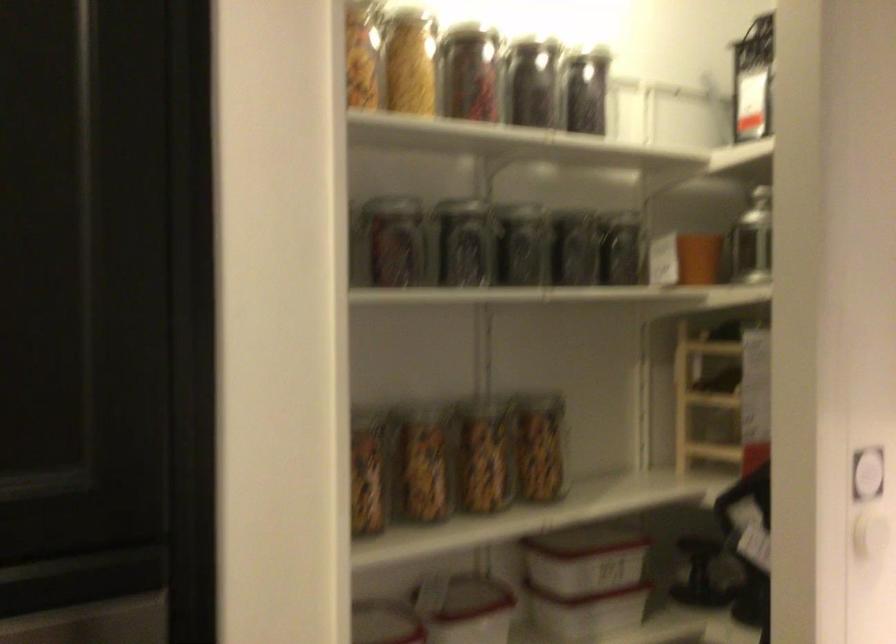
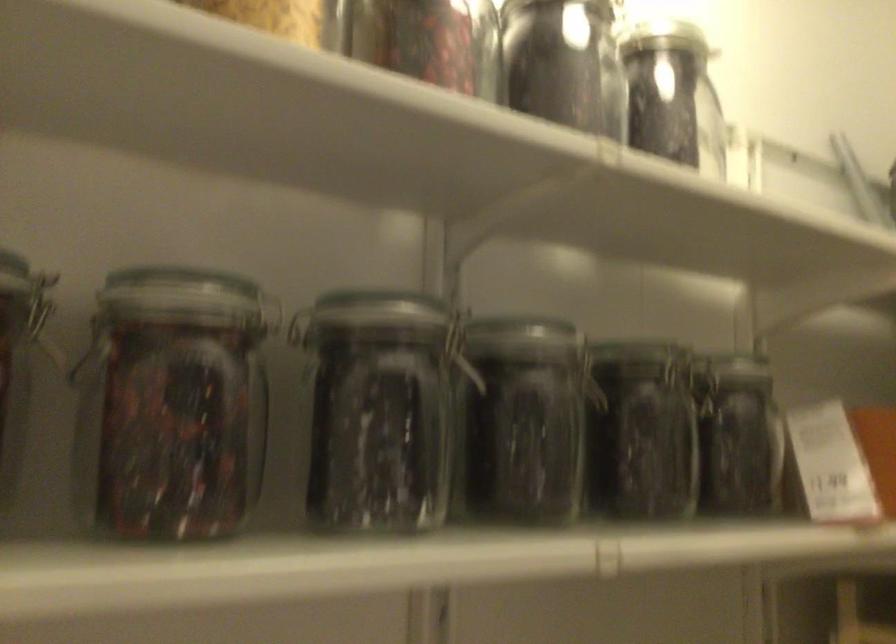
Where in the second image is the point corresponding to point (595, 90) from the first image?

(673, 95)